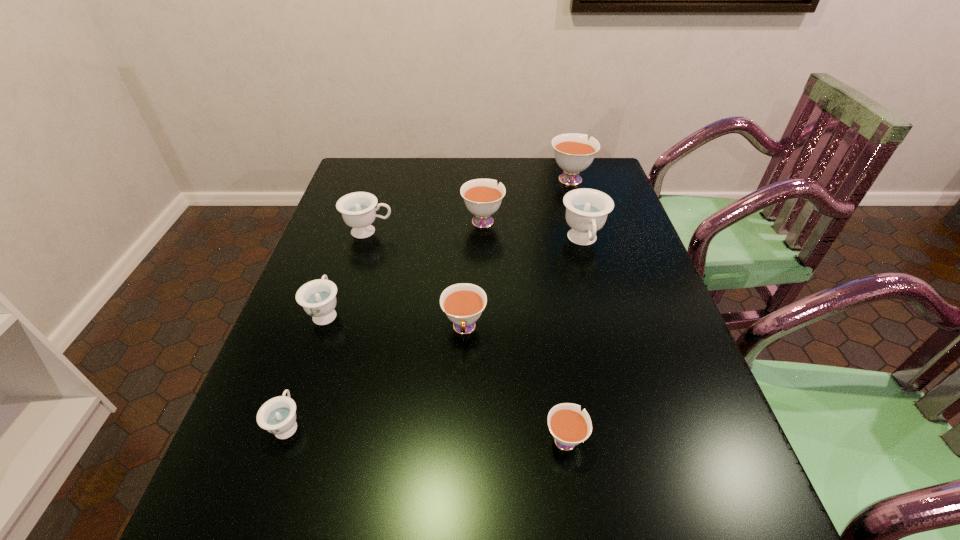
I want to click on vacant space located 0.240m on the side of the rightmost blue teacup with the handle, so click(607, 329).

I want to click on free location located on the side of the second biggest white teacup with the handle, so [483, 194].

Identify the location of vacant space situated on the side of the second biggest white teacup with the handle. (482, 164).

Where is `vacant space located 0.250m on the side of the second biggest white teacup with the handle`? vacant space located 0.250m on the side of the second biggest white teacup with the handle is located at coordinates (482, 167).

You are a GUI agent. You are given a task and a screenshot of the screen. Output one action in this format:
    pyautogui.click(x=<x>, y=<y>)
    Task: Click on the vacant area situated on the side of the second biggest blue teacup with the handle
    
    Given the screenshot: What is the action you would take?
    pyautogui.click(x=452, y=232)

The image size is (960, 540). In order to click on vacant space situated on the side of the second smallest white teacup with the handle in this screenshot , I will do `click(461, 418)`.

Where is `free location located 0.400m on the side of the third biggest blue teacup with the handle`? This screenshot has width=960, height=540. free location located 0.400m on the side of the third biggest blue teacup with the handle is located at coordinates (363, 206).

The image size is (960, 540). Identify the location of free point located on the side of the third biggest blue teacup with the handle. (353, 234).

Locate an element on the screen. The image size is (960, 540). vacant space located on the side of the third biggest blue teacup with the handle is located at coordinates (343, 264).

Find the location of `free space located 0.360m on the side of the second white teacup from right to left with the handle`. free space located 0.360m on the side of the second white teacup from right to left with the handle is located at coordinates (542, 288).